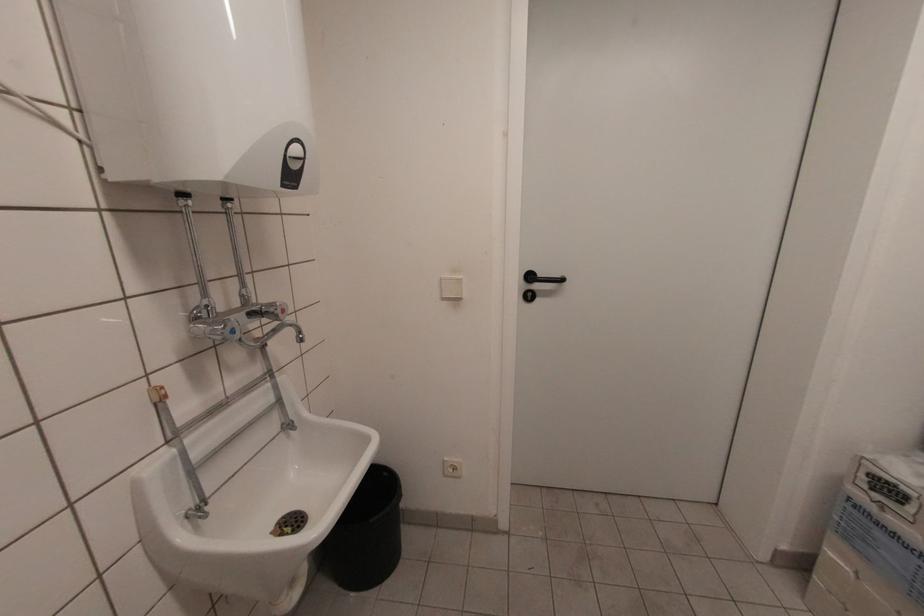
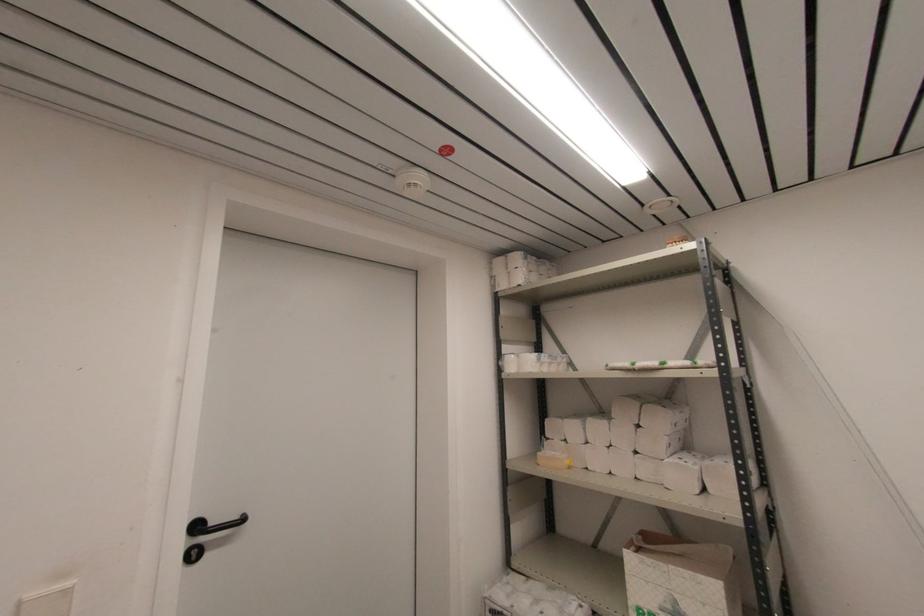
Where in the second image is the point corresponding to [530,299] from the first image?

(196, 557)